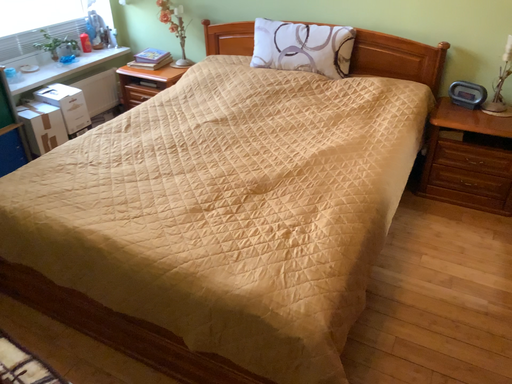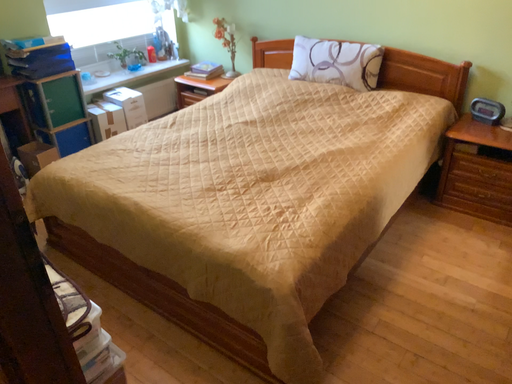
Question: How did the camera likely rotate when shooting the video?

Choices:
 (A) rotated right
 (B) rotated left

Answer: (B)